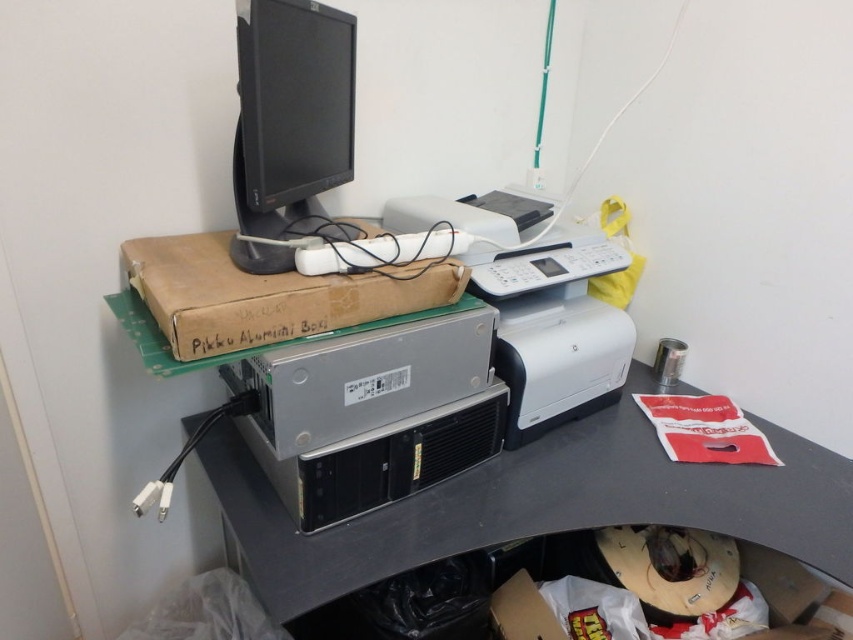
You are standing in front of the desk in the workspace corner. There are two points marked on the desk surface. One is at coordinates point (509, 330) and the other is at point (258, 166). Which point is closer to you?

Point (509, 330) is closer to you because it is further to the viewer than point (258, 166).

You are setting up a new monitor in your workspace. You have a silver metallic computer desk at center and a black glossy monitor at upper center. The monitor needs to be placed exactly 60 centimeters away from the desk for ergonomic reasons. Based on the current setup, is the distance sufficient?

The silver metallic computer desk at center is 59.34 centimeters from the black glossy monitor at upper center. Since 59.34 cm is slightly less than the recommended 60 cm, the current distance is insufficient for ergonomic requirements.